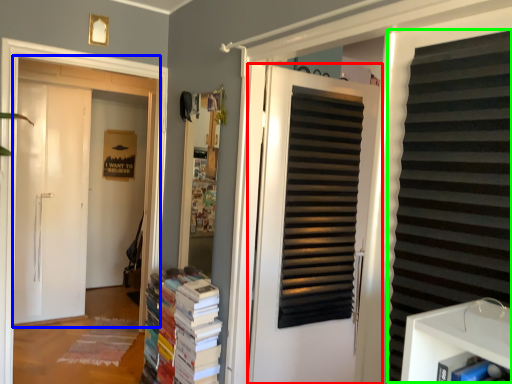
Question: Which is farther away from door (highlighted by a red box)? door (highlighted by a blue box) or shutter (highlighted by a green box)?

Choices:
 (A) door
 (B) shutter

Answer: (A)